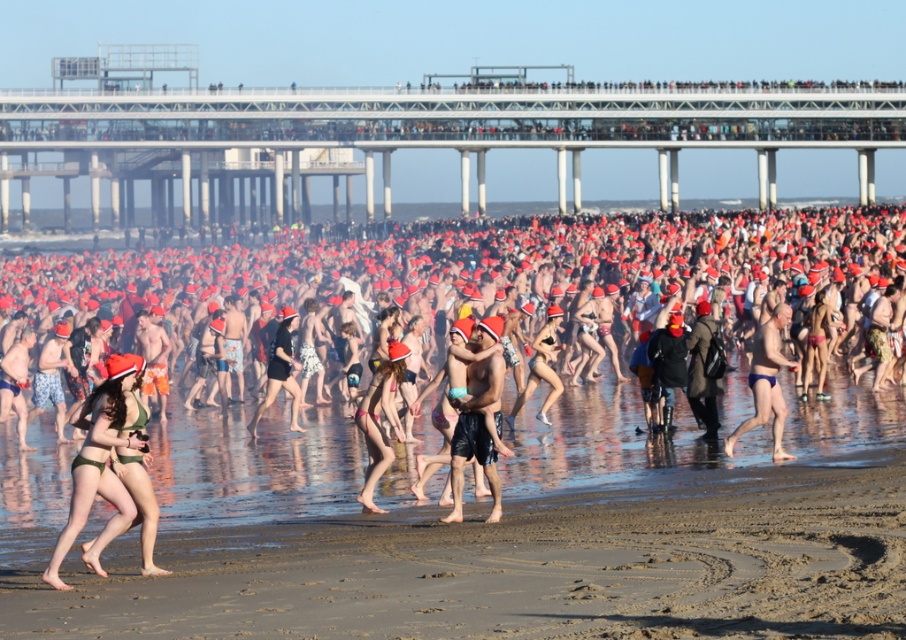
You are a photographer standing at the beach and want to take a photo of both the point at location (391, 595) and the point at (384, 396). Which point should you focus on first to ensure both are in the frame?

You should focus on the point at (384, 396) first because it is further back than the point at (391, 595), allowing both points to be captured in the frame.

You are a photographer standing at the beach and want to take a closeup photo of the green bikini at center. Considering the distance, can you capture it clearly without zooming?

The green bikini at center is 22.61 meters away from camera. To capture it clearly without zooming, you would need a camera with a very long focal length lens capable of reaching that distance. Most standard lenses may not suffice for such a distant subject without significant blur or pixelation.